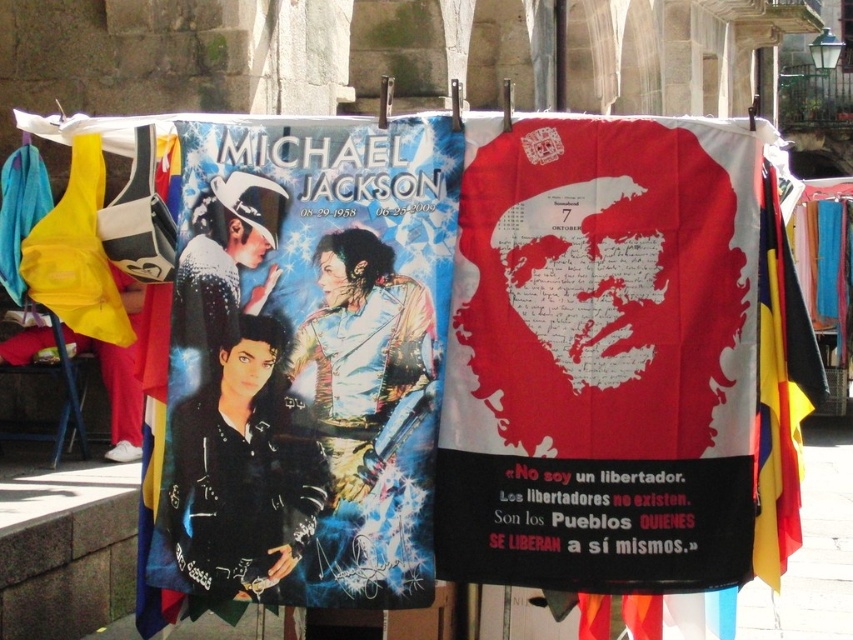
Is red matte poster at center to the left of shiny black jacket at center from the viewer's perspective?

Incorrect, red matte poster at center is not on the left side of shiny black jacket at center.

Is red matte poster at center closer to the viewer compared to shiny black jacket at center?

Yes, red matte poster at center is in front of shiny black jacket at center.

Find the location of a particular element. red matte poster at center is located at coordinates (601, 356).

Identify the location of red matte poster at center. The height and width of the screenshot is (640, 853). (601, 356).

Is yellow fabric at left bigger than matte blue fabric at left?

Indeed, yellow fabric at left has a larger size compared to matte blue fabric at left.

Can you confirm if yellow fabric at left is positioned to the right of matte blue fabric at left?

Indeed, yellow fabric at left is positioned on the right side of matte blue fabric at left.

The width and height of the screenshot is (853, 640). Describe the element at coordinates (76, 253) in the screenshot. I see `yellow fabric at left` at that location.

Find the location of `yellow fabric at left`. yellow fabric at left is located at coordinates (76, 253).

Is red matte poster at center further to the viewer compared to metallic reflective poster at center?

No, it is in front of metallic reflective poster at center.

Does red matte poster at center appear under metallic reflective poster at center?

No, red matte poster at center is not below metallic reflective poster at center.

Where is `red matte poster at center`? red matte poster at center is located at coordinates (601, 356).